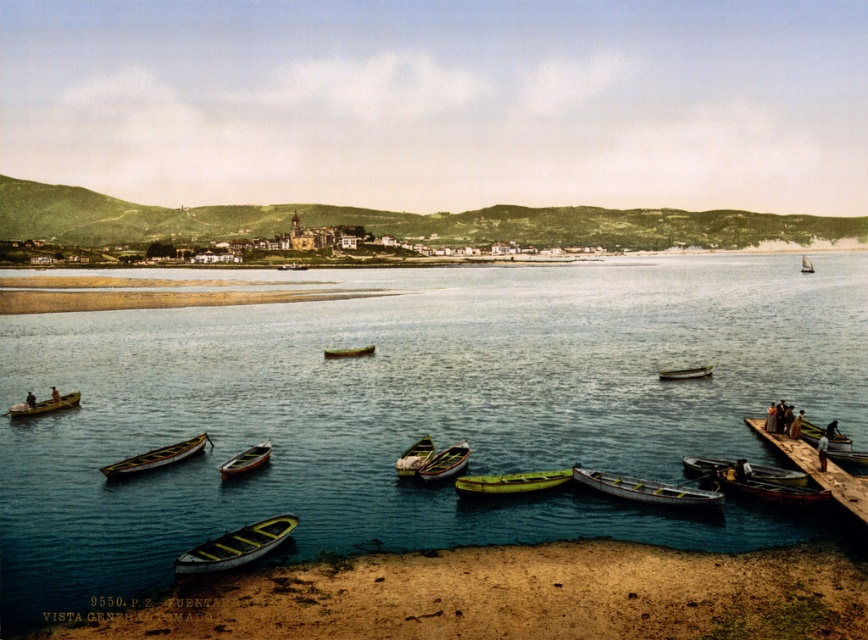
Question: Is yellow wood boat at lower left wider than green wooden boat at center?

Choices:
 (A) no
 (B) yes

Answer: (B)

Question: Can you confirm if wooden pier at lower right is positioned to the right of wooden rowboat at lower center?

Choices:
 (A) yes
 (B) no

Answer: (A)

Question: Estimate the real-world distances between objects in this image. Which object is closer to the wooden boat at center?

Choices:
 (A) green plastic boat at upper right
 (B) wooden canoe at left
 (C) wooden canoe at center

Answer: (C)

Question: Which is nearer to the wooden canoe at lower right?

Choices:
 (A) green polished wood canoe at center
 (B) green wooden canoe at lower right
 (C) wooden canoe at lower left
 (D) green matte boat at center

Answer: (B)

Question: Is the position of green polished wood canoe at center less distant than that of green wooden canoe at lower right?

Choices:
 (A) yes
 (B) no

Answer: (B)

Question: Among these objects, which one is nearest to the camera?

Choices:
 (A) wooden canoe at left
 (B) green polished wood canoe at center
 (C) smooth sand beach at lower left
 (D) clear blue water at center

Answer: (C)